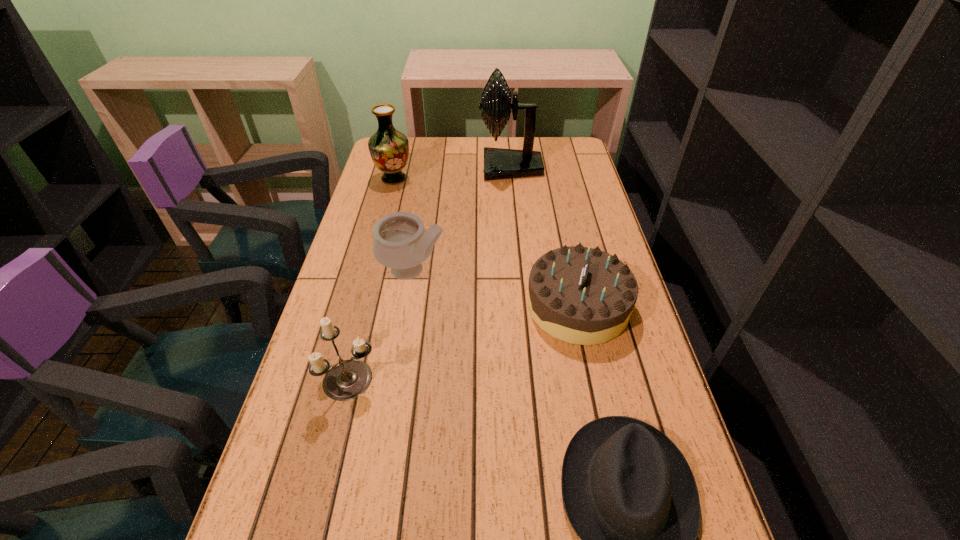
I want to click on vacant space at the left edge of the desktop, so click(353, 330).

The height and width of the screenshot is (540, 960). In order to click on free spot at the right edge of the desktop in this screenshot , I will do `click(612, 382)`.

The width and height of the screenshot is (960, 540). In the image, there is a desktop. In order to click on free space at the far right corner in this screenshot , I will do `click(552, 167)`.

Identify the location of free space between the third tallest object and the birthday cake. Image resolution: width=960 pixels, height=540 pixels. (495, 288).

Locate an element on the screen. The height and width of the screenshot is (540, 960). free space that is in between the vase and the birthday cake is located at coordinates (486, 242).

Image resolution: width=960 pixels, height=540 pixels. Find the location of `free spot between the fifth farthest object and the tallest object`. free spot between the fifth farthest object and the tallest object is located at coordinates (431, 274).

The width and height of the screenshot is (960, 540). What are the coordinates of `free point between the candle holder and the tallest object` in the screenshot? It's located at (431, 274).

This screenshot has width=960, height=540. What are the coordinates of `empty space between the fifth tallest object and the fan` in the screenshot? It's located at (544, 237).

What are the coordinates of `vacant space that's between the fifth farthest object and the third tallest object` in the screenshot? It's located at (382, 325).

Identify which object is located as the second nearest to the pottery. Please provide its 2D coordinates. Your answer should be formatted as a tuple, i.e. [(x, y)], where the tuple contains the x and y coordinates of a point satisfying the conditions above.

[(580, 295)]